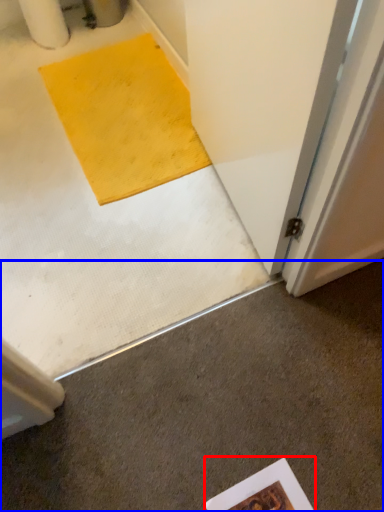
Question: Which point is closer to the camera, writing (highlighted by a red box) or concrete (highlighted by a blue box)?

Choices:
 (A) writing
 (B) concrete

Answer: (B)